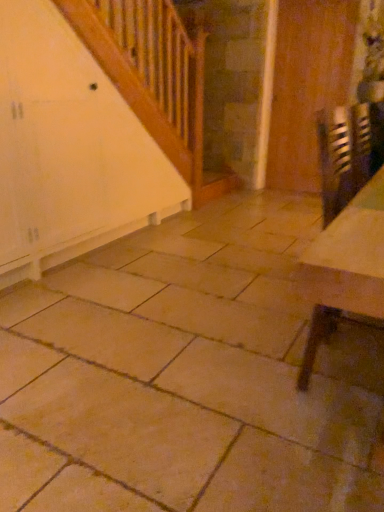
Question: Does wooden door at right touch metallic reflective table at lower right?

Choices:
 (A) yes
 (B) no

Answer: (B)

Question: Is the position of wooden door at right more distant than that of metallic reflective table at lower right?

Choices:
 (A) yes
 (B) no

Answer: (A)

Question: Could metallic reflective table at lower right be considered to be inside wooden door at right?

Choices:
 (A) yes
 (B) no

Answer: (B)

Question: From the image's perspective, is wooden door at right beneath metallic reflective table at lower right?

Choices:
 (A) yes
 (B) no

Answer: (B)

Question: From a real-world perspective, is wooden door at right located higher than metallic reflective table at lower right?

Choices:
 (A) yes
 (B) no

Answer: (A)

Question: Does wooden door at right have a lesser height compared to metallic reflective table at lower right?

Choices:
 (A) no
 (B) yes

Answer: (A)

Question: From a real-world perspective, is metallic reflective table at lower right on top of wooden door at right?

Choices:
 (A) yes
 (B) no

Answer: (B)

Question: From a real-world perspective, is metallic reflective table at lower right below wooden door at right?

Choices:
 (A) no
 (B) yes

Answer: (B)

Question: Is metallic reflective table at lower right in front of wooden door at right?

Choices:
 (A) no
 (B) yes

Answer: (B)

Question: Can you confirm if metallic reflective table at lower right is bigger than wooden door at right?

Choices:
 (A) yes
 (B) no

Answer: (A)

Question: Is wooden door at right completely or partially inside metallic reflective table at lower right?

Choices:
 (A) no
 (B) yes

Answer: (A)

Question: Does metallic reflective table at lower right touch wooden door at right?

Choices:
 (A) no
 (B) yes

Answer: (A)

Question: From their relative heights in the image, would you say metallic reflective table at lower right is taller or shorter than wooden door at right?

Choices:
 (A) short
 (B) tall

Answer: (A)